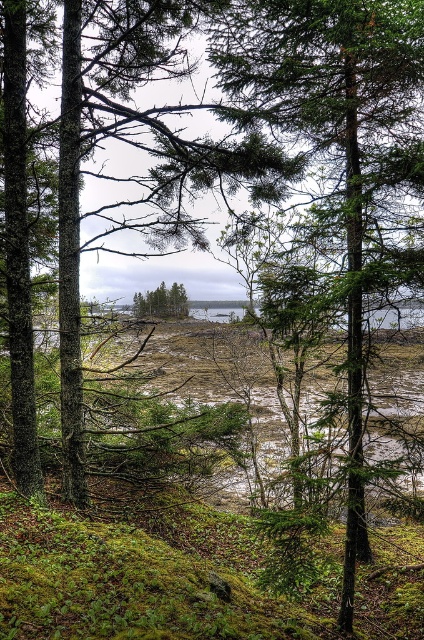
You are a hiker trying to identify the tallest tree in the center of the forest. Which one between the green textured tree at center and the green matte tree at center should you choose?

The green textured tree at center is much taller than the green matte tree at center, so you should choose the green textured tree at center as the tallest one.

Looking at this image, you are a hiker carrying a 2 meter long ladder. You need to place the ladder between the green textured tree at center and the green matte tree at center. Can you fit the ladder horizontally between them without bending it?

The distance between the green textured tree at center and the green matte tree at center is 7.40 meters. Since the ladder is only 2 meters long, it can easily be placed horizontally between them without bending.

You are standing at the center of the image and want to walk towards the green textured tree at center. Which direction should you move?

The green textured tree at center is already at the center of the image, so you don not need to move in any direction to reach it.